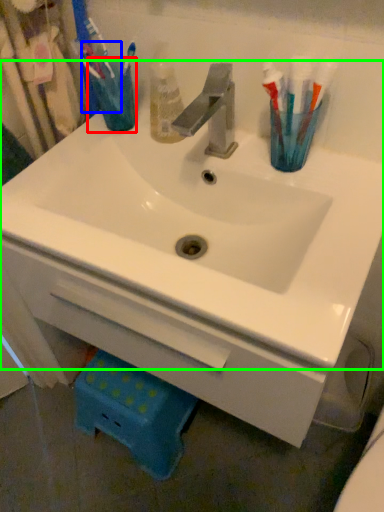
Question: Estimate the real-world distances between objects in this image. Which object is closer to turquoise (highlighted by a red box), toothbrush (highlighted by a blue box) or sink (highlighted by a green box)?

Choices:
 (A) toothbrush
 (B) sink

Answer: (A)